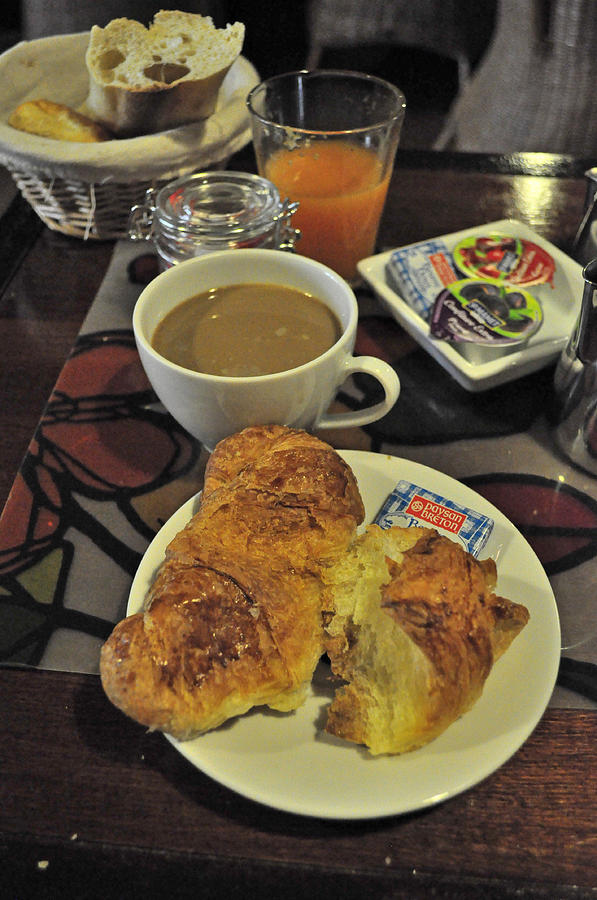
You are a GUI agent. You are given a task and a screenshot of the screen. Output one action in this format:
    pyautogui.click(x=<x>, y=<y>)
    Task: Click on the glass cup
    
    Given the screenshot: What is the action you would take?
    pyautogui.click(x=346, y=147)